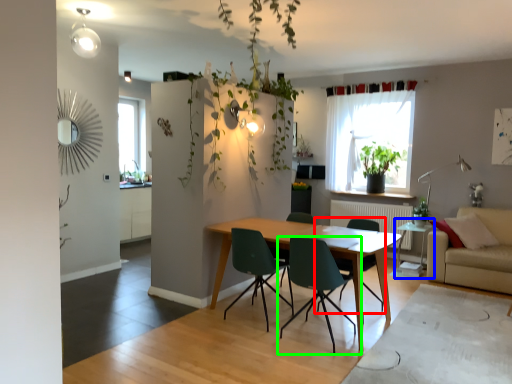
Question: Which is nearer to the chair (highlighted by a red box)? side table (highlighted by a blue box) or chair (highlighted by a green box).

Choices:
 (A) side table
 (B) chair

Answer: (B)